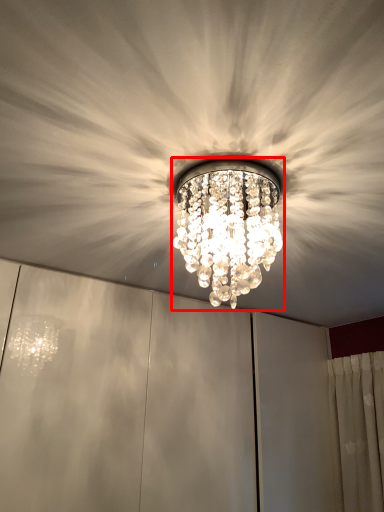
Question: From the image's perspective, what is the correct spatial relationship of lamp (annotated by the red box) in relation to fan?

Choices:
 (A) below
 (B) above

Answer: (B)